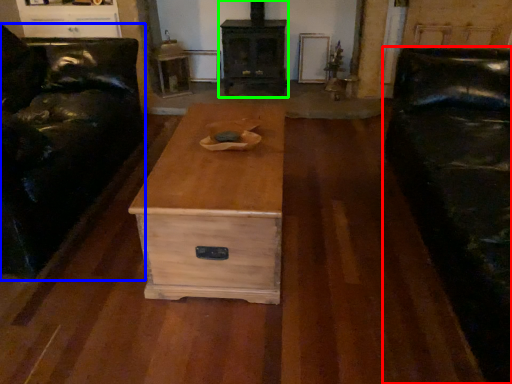
Question: Which object is the closest to the studio couch (highlighted by a red box)? Choose among these: furniture (highlighted by a blue box) or fireplace (highlighted by a green box).

Choices:
 (A) furniture
 (B) fireplace

Answer: (B)